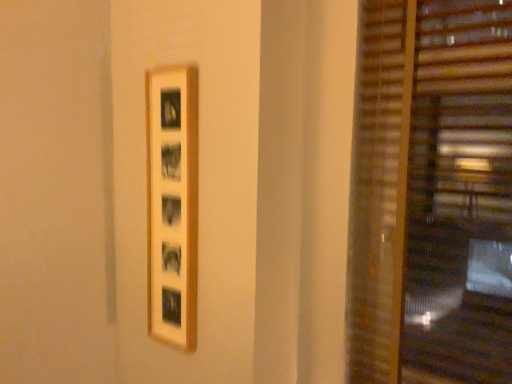
This screenshot has height=384, width=512. What do you see at coordinates (172, 203) in the screenshot?
I see `wooden picture frame at center` at bounding box center [172, 203].

This screenshot has width=512, height=384. Identify the location of wooden picture frame at center. (172, 203).

What is the approximate height of wooden blinds at right?

wooden blinds at right is 4.37 feet tall.

Describe the element at coordinates (432, 194) in the screenshot. This screenshot has width=512, height=384. I see `wooden blinds at right` at that location.

This screenshot has height=384, width=512. I want to click on wooden blinds at right, so click(432, 194).

Locate an element on the screen. wooden picture frame at center is located at coordinates (172, 203).

Considering the relative positions of wooden picture frame at center and wooden blinds at right in the image provided, is wooden picture frame at center to the right of wooden blinds at right from the viewer's perspective?

Incorrect, wooden picture frame at center is not on the right side of wooden blinds at right.

Is wooden picture frame at center in front of or behind wooden blinds at right in the image?

Clearly, wooden picture frame at center is behind wooden blinds at right.

Which point is more distant from viewer, (x=187, y=92) or (x=466, y=357)?

The point (x=187, y=92) is behind.

From the image's perspective, which object appears higher, wooden picture frame at center or wooden blinds at right?

wooden blinds at right appears higher in the image.

From a real-world perspective, between wooden picture frame at center and wooden blinds at right, who is vertically lower?

In real-world perspective, wooden picture frame at center is lower.

Looking at their sizes, would you say wooden picture frame at center is wider or thinner than wooden blinds at right?

wooden picture frame at center is thinner than wooden blinds at right.

Considering the relative sizes of wooden picture frame at center and wooden blinds at right in the image provided, is wooden picture frame at center shorter than wooden blinds at right?

Yes.

Which of these two, wooden picture frame at center or wooden blinds at right, is bigger?

wooden blinds at right is bigger.

Which is correct: wooden picture frame at center is inside wooden blinds at right, or outside of it?

wooden picture frame at center is located beyond the bounds of wooden blinds at right.

In the scene shown: Is wooden picture frame at center in contact with wooden blinds at right?

No, wooden picture frame at center is not beside wooden blinds at right.

Is wooden picture frame at center facing away from wooden blinds at right?

wooden picture frame at center does not have its back to wooden blinds at right.

Can you tell me how much wooden picture frame at center and wooden blinds at right differ in facing direction?

The angular difference between wooden picture frame at center and wooden blinds at right is 2.11 degrees.

Image resolution: width=512 pixels, height=384 pixels. Identify the location of window blind above the wooden picture frame at center (from the image's perspective). (x=432, y=194).

Which is more to the left, wooden blinds at right or wooden picture frame at center?

wooden picture frame at center.

Is wooden blinds at right in front of or behind wooden picture frame at center in the image?

In the image, wooden blinds at right appears in front of wooden picture frame at center.

Is point (482, 325) more distant than point (196, 198)?

No, (482, 325) is in front of (196, 198).

From the image's perspective, which one is positioned lower, wooden blinds at right or wooden picture frame at center?

wooden picture frame at center appears lower in the image.

From a real-world perspective, is wooden blinds at right under wooden picture frame at center?

No, from a real-world perspective, wooden blinds at right is not under wooden picture frame at center.

Between wooden blinds at right and wooden picture frame at center, which one has smaller width?

wooden picture frame at center.

Is wooden blinds at right taller or shorter than wooden picture frame at center?

wooden blinds at right is taller than wooden picture frame at center.

Based on their sizes in the image, would you say wooden blinds at right is bigger or smaller than wooden picture frame at center?

wooden blinds at right is bigger than wooden picture frame at center.

Do you think wooden blinds at right is within wooden picture frame at center, or outside of it?

The correct answer is: outside.

Is wooden blinds at right not close to wooden picture frame at center?

No, wooden blinds at right is in close proximity to wooden picture frame at center.

From the picture: Is wooden blinds at right positioned with its back to wooden picture frame at center?

No, wooden blinds at right's orientation is not away from wooden picture frame at center.

How far apart are wooden blinds at right and wooden picture frame at center?

27.82 inches.

The width and height of the screenshot is (512, 384). In order to click on window blind above the wooden picture frame at center (from the image's perspective) in this screenshot , I will do `click(432, 194)`.

I want to click on picture frame that appears on the left of wooden blinds at right, so click(x=172, y=203).

Locate an element on the screen. The image size is (512, 384). picture frame behind the wooden blinds at right is located at coordinates [172, 203].